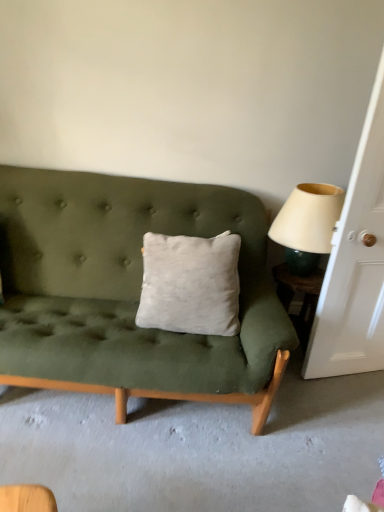
Question: Looking at their shapes, would you say green glossy side table at right is wider or thinner than beige fabric lampshade at right?

Choices:
 (A) thin
 (B) wide

Answer: (A)

Question: From the image's perspective, is green glossy side table at right positioned above or below beige fabric lampshade at right?

Choices:
 (A) above
 (B) below

Answer: (B)

Question: Which object is the closest to the beige fabric lampshade at right?

Choices:
 (A) green glossy side table at right
 (B) white wood door at right

Answer: (B)

Question: Estimate the real-world distances between objects in this image. Which object is farther from the green glossy side table at right?

Choices:
 (A) beige fabric lampshade at right
 (B) white wood door at right

Answer: (B)